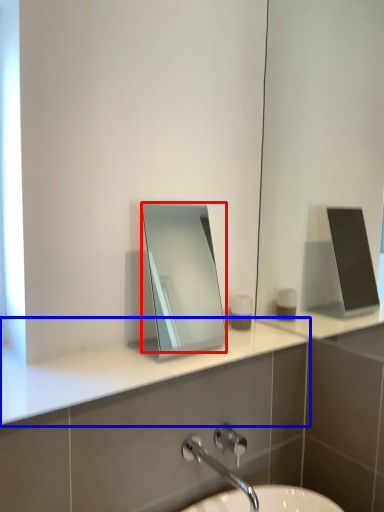
Question: Which object appears farthest to the camera in this image, mirror (highlighted by a red box) or counter top (highlighted by a blue box)?

Choices:
 (A) mirror
 (B) counter top

Answer: (A)